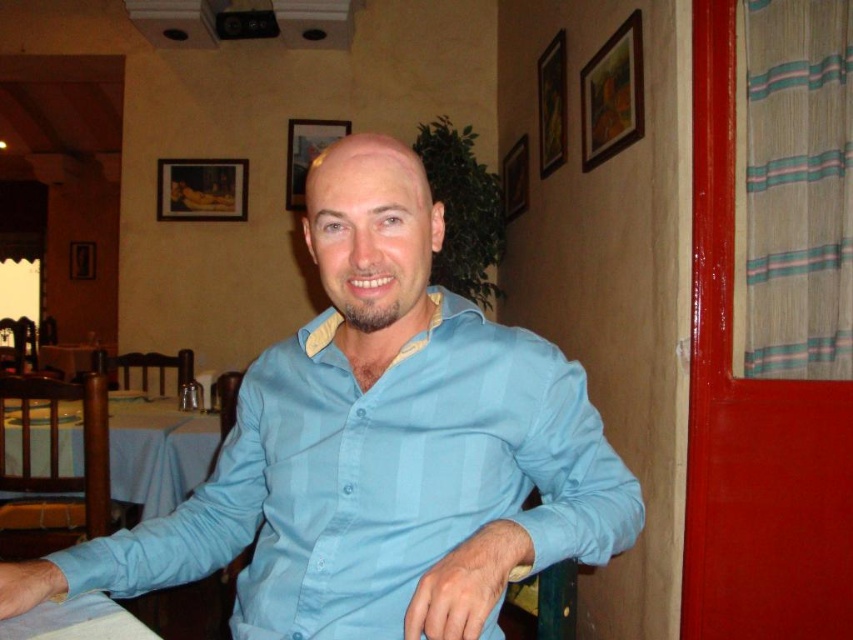
Question: Among these objects, which one is nearest to the camera?

Choices:
 (A) blue fabric table at lower left
 (B) light blue striped shirt at center
 (C) white fabric table at lower left

Answer: (B)

Question: Can you confirm if light blue striped shirt at center is positioned below blue fabric table at lower left?

Choices:
 (A) yes
 (B) no

Answer: (B)

Question: Which point is farther from the camera taking this photo?

Choices:
 (A) (148, 577)
 (B) (183, 496)
 (C) (86, 604)

Answer: (B)

Question: Where is light blue striped shirt at center located in relation to white fabric table at lower left in the image?

Choices:
 (A) above
 (B) below

Answer: (A)

Question: Does light blue striped shirt at center appear on the right side of white fabric table at lower left?

Choices:
 (A) yes
 (B) no

Answer: (A)

Question: Which of these objects is positioned farthest from the blue fabric table at lower left?

Choices:
 (A) white fabric table at lower left
 (B) light blue striped shirt at center

Answer: (A)